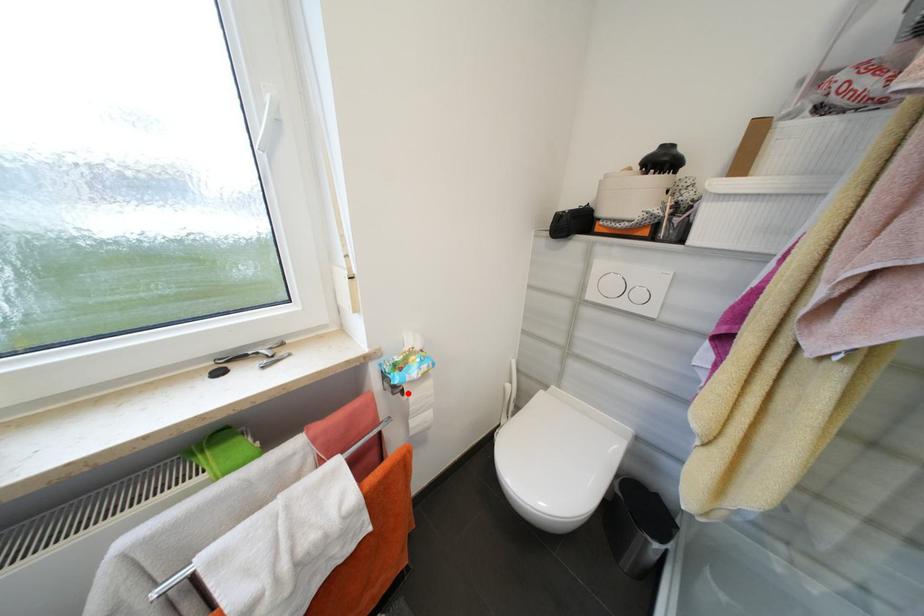
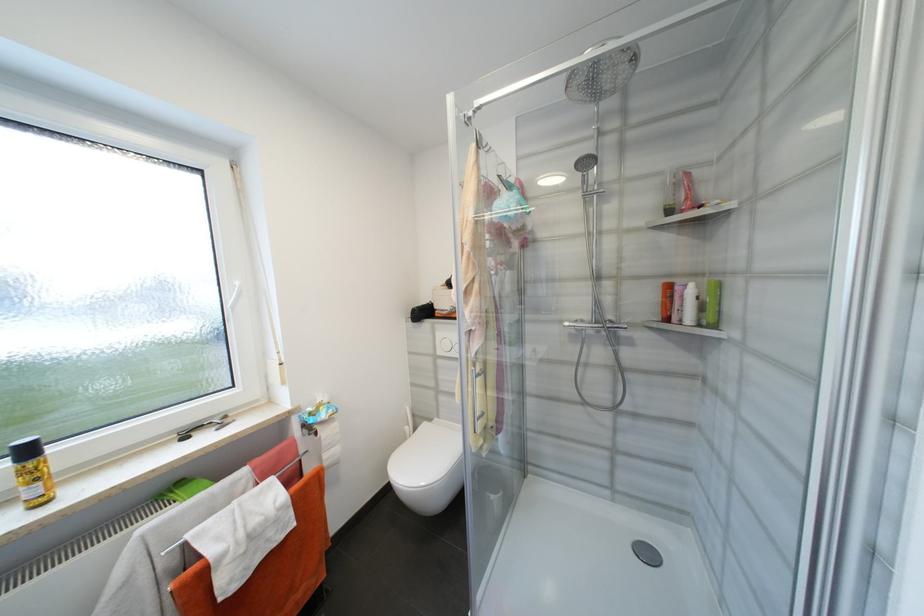
Question: I am providing you with two images of the same scene from different viewpoints. A red point is marked on the first image. At the location where the point appears in image 1, is it still visible in image 2?

Choices:
 (A) Yes
 (B) No

Answer: (A)